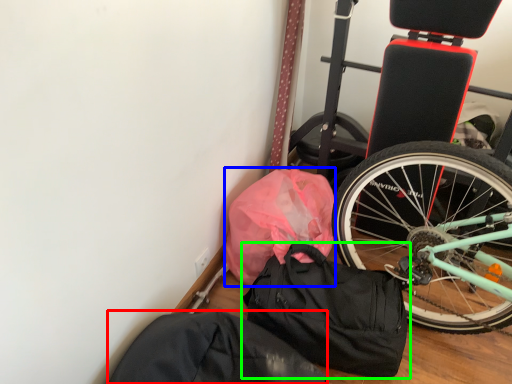
Question: Which is nearer to the sack (highlighted by a red box)? material (highlighted by a blue box) or luggage and bags (highlighted by a green box).

Choices:
 (A) material
 (B) luggage and bags

Answer: (B)